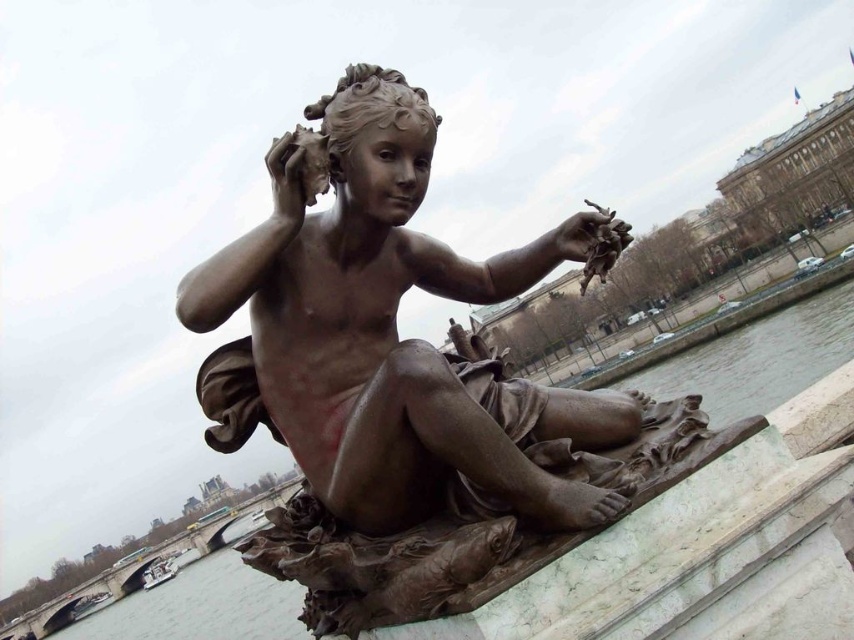
Based on the coordinates provided, which object in the scene is located at point (x=385, y=332)?

The bronze statue at center is located at point (x=385, y=332) according to the coordinates provided.

You are a tourist standing in front of the bronze statue at center. You notice the bronze water at statue center nearby. Which object is positioned higher from the ground?

The bronze statue at center is located above bronze water at statue center, so the bronze statue at center is higher up.

You are an artist planning to paint the riverside scene. You want to ensure the bronze statue at center and bronze water at statue center are proportionally accurate. Which object should you make narrower in your painting?

The bronze statue at center should be made narrower in the painting since it has a lesser width compared to the bronze water at statue center.